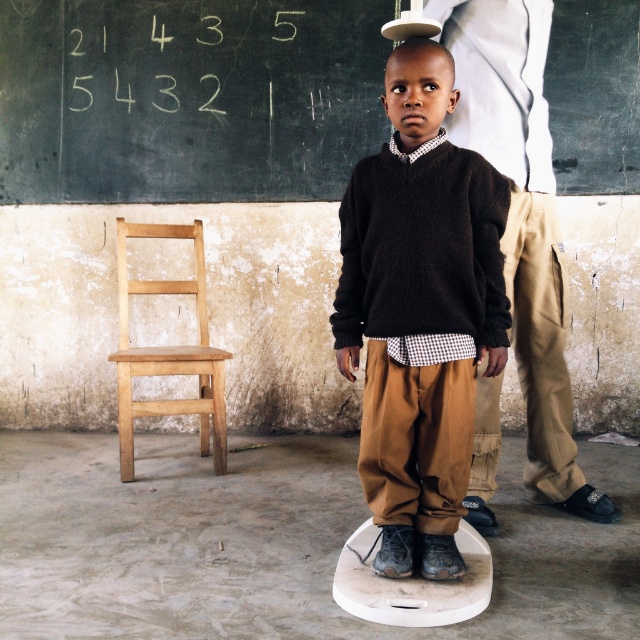
Between point (436, 540) and point (92, 17), which one is positioned behind?

Point (92, 17)

Where is `black wool sweater at center`? black wool sweater at center is located at coordinates (419, 310).

Which of these two, black chalkboard at upper center or white chalk numbers at upper center, stands taller?

black chalkboard at upper center is taller.

Does point (0, 4) come closer to viewer compared to point (230, 83)?

No, (0, 4) is further to viewer.

Who is more distant from viewer, (x=372, y=76) or (x=253, y=88)?

The point (x=253, y=88) is behind.

At what (x,y) coordinates should I click in order to perform the action: click on black chalkboard at upper center. Please return your answer as a coordinate pair (x, y). The image size is (640, 640). Looking at the image, I should click on (188, 99).

Identify the location of light brown wooden chair at left. The height and width of the screenshot is (640, 640). (168, 352).

In the scene shown: Is light brown wooden chair at left taller than white plastic stool at center?

Indeed, light brown wooden chair at left has a greater height compared to white plastic stool at center.

The image size is (640, 640). What do you see at coordinates (168, 352) in the screenshot? I see `light brown wooden chair at left` at bounding box center [168, 352].

Where is `light brown wooden chair at left`? Image resolution: width=640 pixels, height=640 pixels. light brown wooden chair at left is located at coordinates (168, 352).